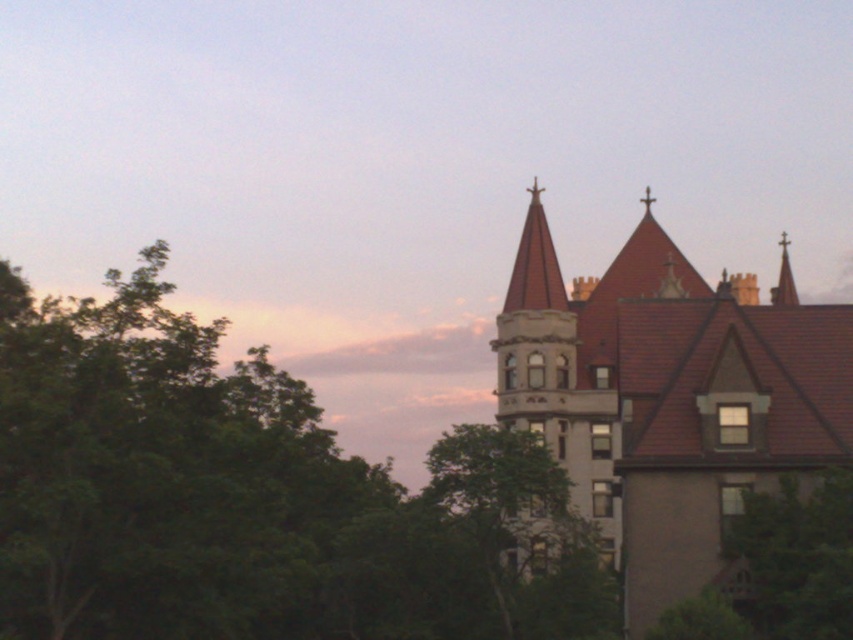
Question: Which object is the closest to the white stone tower at center?

Choices:
 (A) green leafy tree at lower right
 (B) green leafy tree at upper left

Answer: (B)

Question: Which of the following is the farthest from the observer?

Choices:
 (A) (718, 529)
 (B) (520, 296)
 (C) (74, 362)

Answer: (B)

Question: Which point is farther to the camera?

Choices:
 (A) (676, 256)
 (B) (486, 554)
 (C) (74, 301)
 (D) (579, 404)

Answer: (A)

Question: Is green leafy tree at upper left wider than brown stone church at upper right?

Choices:
 (A) no
 (B) yes

Answer: (B)

Question: Can you confirm if green leafy tree at upper left is thinner than white stone tower at center?

Choices:
 (A) no
 (B) yes

Answer: (A)

Question: Can you confirm if green leafy tree at upper left is positioned to the right of white stone tower at center?

Choices:
 (A) yes
 (B) no

Answer: (B)